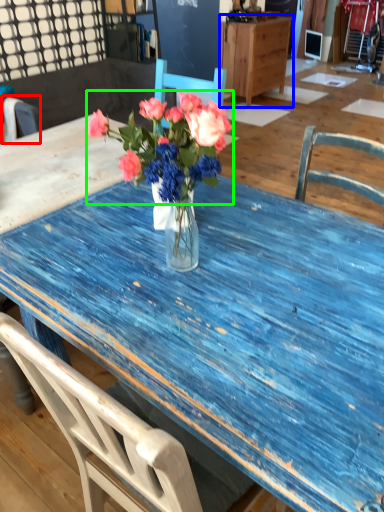
Question: Which object is the farthest from chair (highlighted by a red box)? Choose among these: cabinetry (highlighted by a blue box) or flower (highlighted by a green box).

Choices:
 (A) cabinetry
 (B) flower

Answer: (A)